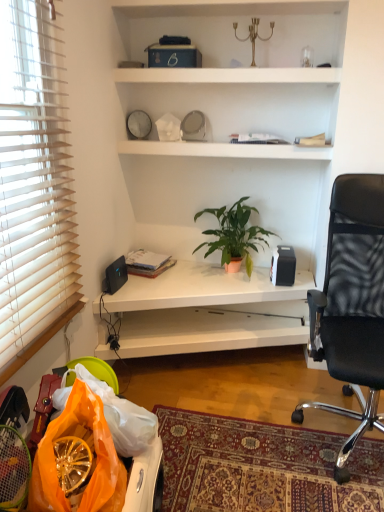
Question: Does green matte plant at center have a lesser height compared to black plastic speaker at lower left, the 1th loudspeaker when ordered from left to right?

Choices:
 (A) no
 (B) yes

Answer: (A)

Question: Is green matte plant at center aimed at black plastic speaker at lower left, which is the second loudspeaker from right to left?

Choices:
 (A) yes
 (B) no

Answer: (B)

Question: Is the surface of green matte plant at center in direct contact with black plastic speaker at lower left, which is the second loudspeaker from right to left?

Choices:
 (A) yes
 (B) no

Answer: (B)

Question: Could black plastic speaker at lower left, which is the second loudspeaker from right to left, be considered to be inside green matte plant at center?

Choices:
 (A) yes
 (B) no

Answer: (B)

Question: From the image's perspective, is green matte plant at center on top of black plastic speaker at lower left, the 1th loudspeaker when ordered from left to right?

Choices:
 (A) yes
 (B) no

Answer: (A)

Question: Is black matte speaker at upper right, acting as the first loudspeaker starting from the right, taller or shorter than green matte plant at center?

Choices:
 (A) tall
 (B) short

Answer: (B)

Question: Is point (276, 271) positioned closer to the camera than point (213, 243)?

Choices:
 (A) farther
 (B) closer

Answer: (B)

Question: From the image's perspective, is black matte speaker at upper right, acting as the first loudspeaker starting from the right, positioned above or below green matte plant at center?

Choices:
 (A) below
 (B) above

Answer: (A)

Question: Is black matte speaker at upper right, acting as the first loudspeaker starting from the right, bigger or smaller than green matte plant at center?

Choices:
 (A) small
 (B) big

Answer: (A)

Question: Is green matte plant at center situated inside black plastic speaker at lower left, which is the second loudspeaker from right to left, or outside?

Choices:
 (A) outside
 (B) inside

Answer: (A)

Question: Looking at their shapes, would you say green matte plant at center is wider or thinner than black plastic speaker at lower left, which is the second loudspeaker from right to left?

Choices:
 (A) wide
 (B) thin

Answer: (A)

Question: Looking at the image, does green matte plant at center seem bigger or smaller compared to black plastic speaker at lower left, which is the second loudspeaker from right to left?

Choices:
 (A) big
 (B) small

Answer: (A)

Question: Considering the positions of green matte plant at center and black plastic speaker at lower left, which is the second loudspeaker from right to left, in the image, is green matte plant at center taller or shorter than black plastic speaker at lower left, which is the second loudspeaker from right to left,?

Choices:
 (A) tall
 (B) short

Answer: (A)

Question: In terms of width, does black matte speaker at upper right, which ranks as the second loudspeaker in left-to-right order, look wider or thinner when compared to matte black book at left?

Choices:
 (A) wide
 (B) thin

Answer: (B)

Question: From their relative heights in the image, would you say black matte speaker at upper right, which ranks as the second loudspeaker in left-to-right order, is taller or shorter than matte black book at left?

Choices:
 (A) tall
 (B) short

Answer: (A)